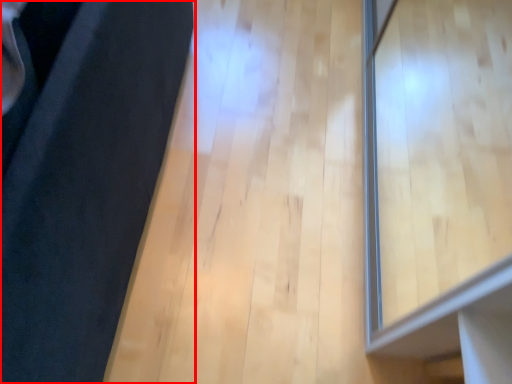
Question: Where is furniture (annotated by the red box) located in relation to window in the image?

Choices:
 (A) left
 (B) right

Answer: (A)